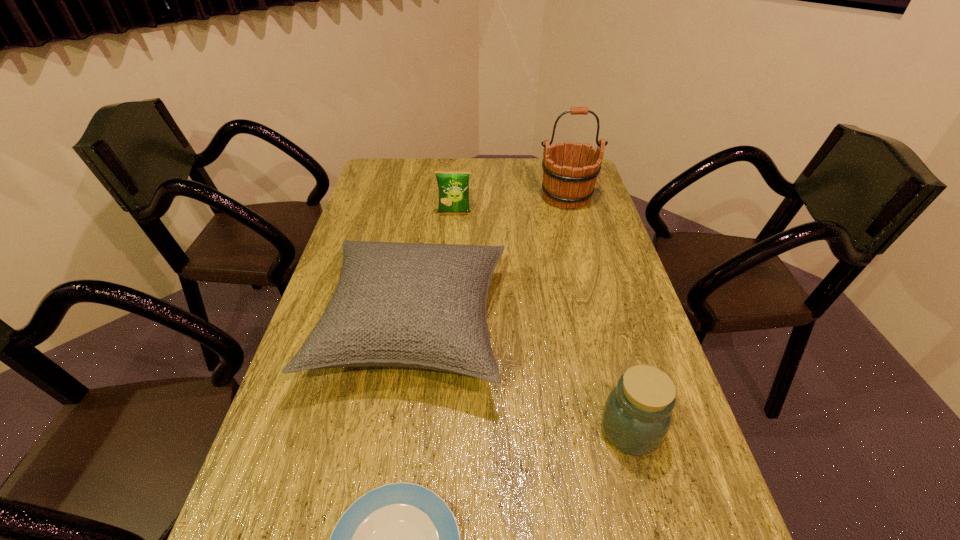
Identify the location of wine bucket. The image size is (960, 540). 562,185.

Identify the location of cushion. (415, 305).

In order to click on crisp (potato chip) in this screenshot , I will do `click(453, 186)`.

Locate an element on the screen. jar is located at coordinates (637, 415).

Image resolution: width=960 pixels, height=540 pixels. What are the coordinates of `vacant space located on the front of the wine bucket` in the screenshot? It's located at (577, 237).

Image resolution: width=960 pixels, height=540 pixels. In order to click on vacant space located on the back of the cushion in this screenshot , I will do `click(430, 212)`.

Image resolution: width=960 pixels, height=540 pixels. Find the location of `free space located 0.260m on the front-facing side of the crisp (potato chip)`. free space located 0.260m on the front-facing side of the crisp (potato chip) is located at coordinates (450, 267).

The width and height of the screenshot is (960, 540). Identify the location of vacant space located 0.190m on the left of the jar. (509, 430).

Where is `object located in the far edge section of the desktop`? object located in the far edge section of the desktop is located at coordinates (562, 185).

This screenshot has height=540, width=960. Find the location of `object positioned at the left edge`. object positioned at the left edge is located at coordinates (415, 305).